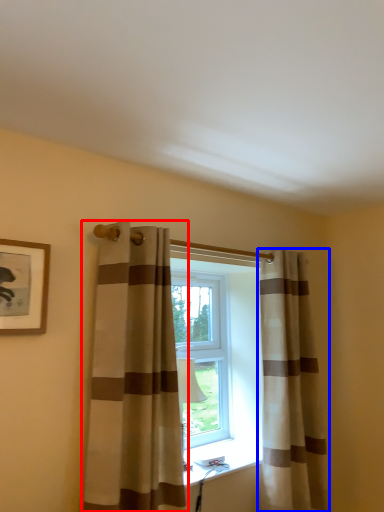
Question: Which object is further to the camera taking this photo, curtain (highlighted by a red box) or curtain (highlighted by a blue box)?

Choices:
 (A) curtain
 (B) curtain

Answer: (B)